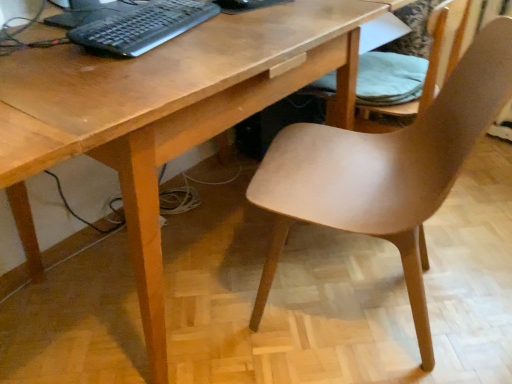
At what (x,y) coordinates should I click in order to perform the action: click on vacant area situated below matte wood chair at center, which is the 1th chair from front to back (from a real-world perspective). Please return your answer as a coordinate pair (x, y). The width and height of the screenshot is (512, 384). Looking at the image, I should click on (347, 295).